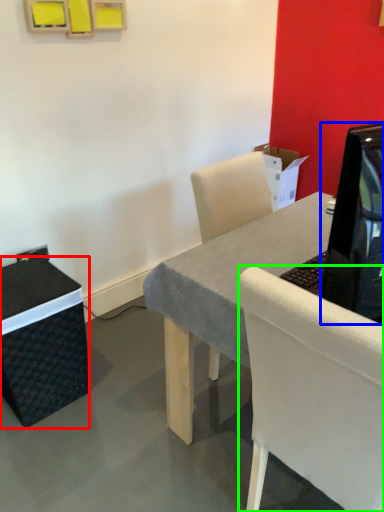
Question: Considering the real-world distances, which object is farthest from box (highlighted by a red box)? television (highlighted by a blue box) or chair (highlighted by a green box)?

Choices:
 (A) television
 (B) chair

Answer: (A)